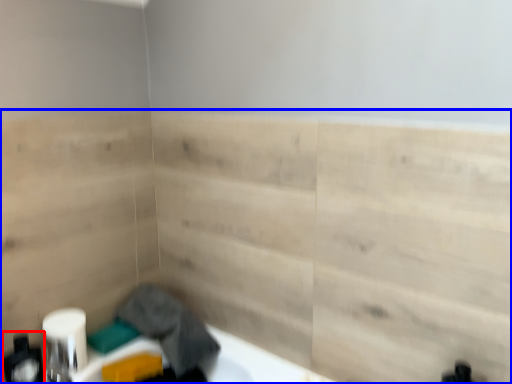
Question: Which point is closer to the camera, toiletry (highlighted by a red box) or plywood (highlighted by a blue box)?

Choices:
 (A) toiletry
 (B) plywood

Answer: (B)